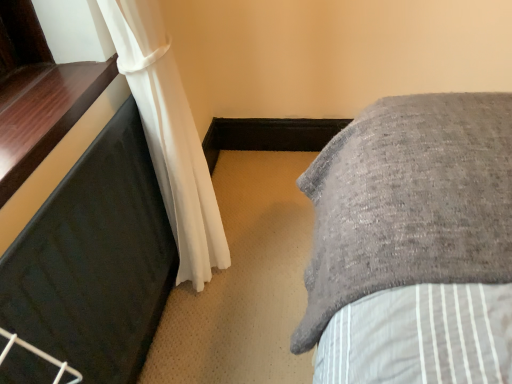
Identify the location of free space in front of white sheer curtain at left. The image size is (512, 384). (232, 328).